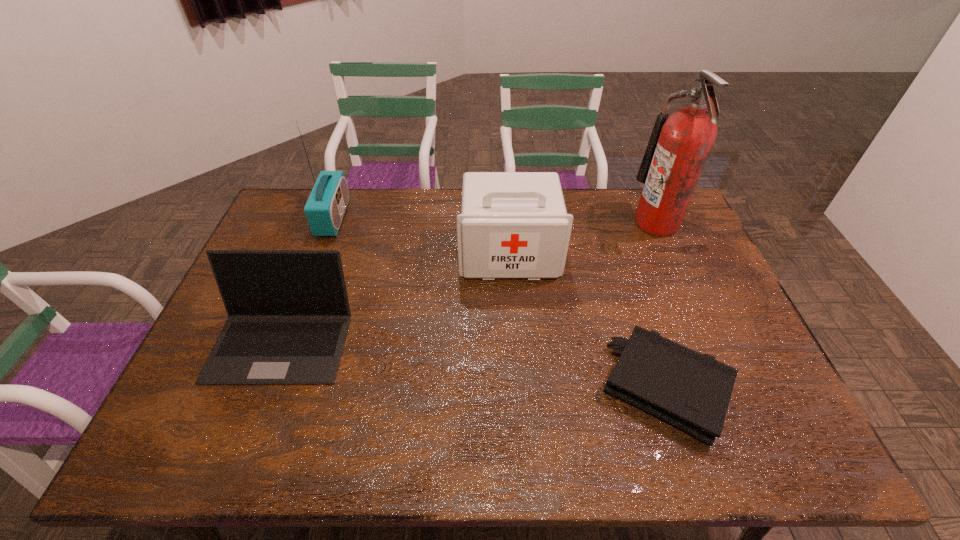
Identify the location of vacant area situated 0.110m on the front-facing side of the third object from left to right. (513, 309).

In order to click on vacant area situated 0.080m on the screen of the laptop in this screenshot , I will do `click(253, 415)`.

In order to click on blank space located on the left of the Bible in this screenshot , I will do `click(480, 387)`.

Locate an element on the screen. Image resolution: width=960 pixels, height=540 pixels. fire extinguisher situated at the far edge is located at coordinates (678, 148).

In order to click on radio receiver that is at the far edge in this screenshot , I will do (325, 208).

This screenshot has height=540, width=960. What are the coordinates of `the first-aid kit present at the far edge` in the screenshot? It's located at (512, 224).

The width and height of the screenshot is (960, 540). Find the location of `object located in the near edge section of the desktop`. object located in the near edge section of the desktop is located at coordinates (691, 391).

The image size is (960, 540). I want to click on radio receiver present at the left edge, so click(x=325, y=208).

Identify the location of laptop at the left edge. (288, 312).

Identify the location of fire extinguisher located at the right edge. The image size is (960, 540). (678, 148).